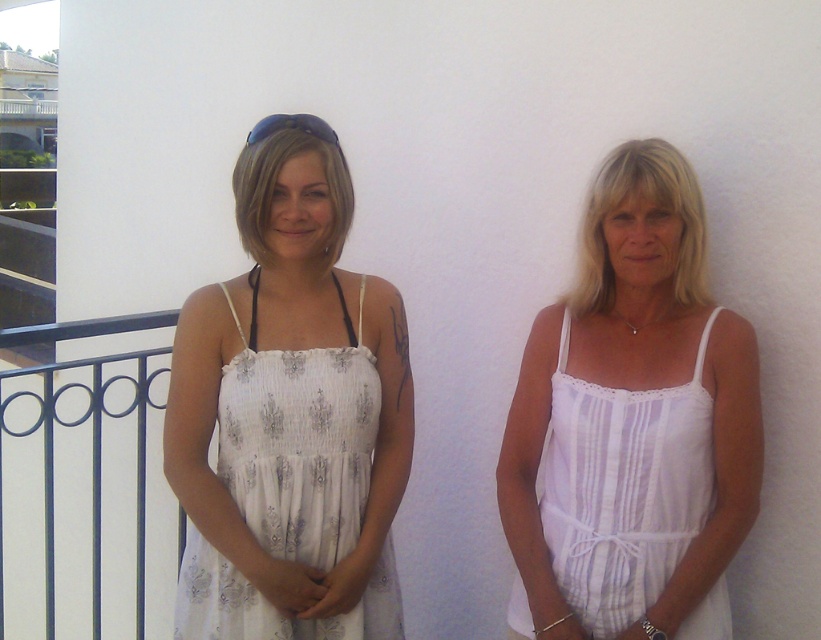
You are a fashion stylist observing two dresses in the image. The white sheer fabric dress at center and the white striped fabric dress at right. Which dress is positioned to the left of the other?

The white sheer fabric dress at center is positioned to the left of the white striped fabric dress at right.

You are standing 2 meters away from the railing in the image. A point at coordinate point (180, 566) is located on the railing. Can you reach that point without moving closer?

The point (180, 566) is 1.92 meters away from the viewer. Since you are already 2 meters away, you cannot reach it without moving closer.

You are a fashion designer observing two dresses displayed on mannequins in a store window. The mannequins are positioned side by side. The dresses are the white sheer fabric dress at center and the white striped fabric dress at right. Which dress is taller when viewed from the front?

The white sheer fabric dress at center is taller than the white striped fabric dress at right.